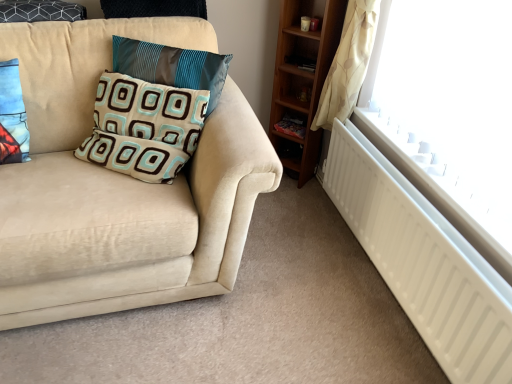
Describe the element at coordinates (12, 116) in the screenshot. This screenshot has width=512, height=384. I see `blue fabric pillow at left, the 1th pillow when ordered from left to right` at that location.

What is the approximate height of patterned fabric pillow at center, acting as the 2th pillow starting from the right?

11.51 inches.

This screenshot has width=512, height=384. Describe the element at coordinates (144, 128) in the screenshot. I see `patterned fabric pillow at center, acting as the 2th pillow starting from the right` at that location.

What do you see at coordinates (423, 261) in the screenshot? Image resolution: width=512 pixels, height=384 pixels. I see `white matte radiator at lower right` at bounding box center [423, 261].

Locate an element on the screen. This screenshot has width=512, height=384. blue fabric pillow at left, acting as the third pillow starting from the right is located at coordinates (12, 116).

Considering the relative sizes of wooden shelf at lower right and patterned fabric pillow at center, acting as the 2th pillow starting from the right, in the image provided, is wooden shelf at lower right thinner than patterned fabric pillow at center, acting as the 2th pillow starting from the right,?

Indeed, wooden shelf at lower right has a lesser width compared to patterned fabric pillow at center, acting as the 2th pillow starting from the right.

Between wooden shelf at lower right and patterned fabric pillow at center, marked as the second pillow in a left-to-right arrangement, which one appears on the left side from the viewer's perspective?

patterned fabric pillow at center, marked as the second pillow in a left-to-right arrangement.

Find the location of a particular element. The width and height of the screenshot is (512, 384). shelf behind the patterned fabric pillow at center, acting as the 2th pillow starting from the right is located at coordinates (292, 124).

From the picture: Is teal satin pillow at upper left, the 3th pillow from the left, in contact with white matte radiator at lower right?

teal satin pillow at upper left, the 3th pillow from the left, and white matte radiator at lower right are not in contact.

In order to click on radiator in front of the teal satin pillow at upper left, the 3th pillow from the left in this screenshot , I will do `click(423, 261)`.

Based on the photo, looking at the image, does teal satin pillow at upper left, arranged as the first pillow when viewed from the right, seem bigger or smaller compared to white matte radiator at lower right?

Considering their sizes, teal satin pillow at upper left, arranged as the first pillow when viewed from the right, takes up less space than white matte radiator at lower right.

From the picture: Which is closer to the camera, (123,53) or (391,239)?

Positioned in front is point (391,239).

Would you consider teal satin pillow at upper left, the 3th pillow from the left, to be distant from wooden shelf at lower right?

They are positioned close to each other.

From the image's perspective, is teal satin pillow at upper left, the 3th pillow from the left, on top of wooden shelf at lower right?

Yes, from the image's perspective, teal satin pillow at upper left, the 3th pillow from the left, is over wooden shelf at lower right.

From a real-world perspective, who is located lower, teal satin pillow at upper left, the 3th pillow from the left, or wooden shelf at lower right?

wooden shelf at lower right.

From the picture: Considering the sizes of objects teal satin pillow at upper left, the 3th pillow from the left, and wooden shelf at lower right in the image provided, who is shorter, teal satin pillow at upper left, the 3th pillow from the left, or wooden shelf at lower right?

With less height is wooden shelf at lower right.

This screenshot has height=384, width=512. What are the coordinates of `the 2nd pillow to the left of the wooden shelf at lower right, counting from the anchor's position` in the screenshot? It's located at [x=144, y=128].

Is point (143, 102) less distant than point (283, 125)?

Yes, point (143, 102) is closer to viewer.

How many degrees apart are the facing directions of patterned fabric pillow at center, marked as the second pillow in a left-to-right arrangement, and wooden shelf at lower right?

patterned fabric pillow at center, marked as the second pillow in a left-to-right arrangement, and wooden shelf at lower right are facing 12.4 degrees away from each other.

Looking at their sizes, would you say patterned fabric pillow at center, marked as the second pillow in a left-to-right arrangement, is wider or thinner than wooden shelf at lower right?

Clearly, patterned fabric pillow at center, marked as the second pillow in a left-to-right arrangement, has more width compared to wooden shelf at lower right.

Is there a large distance between white matte radiator at lower right and patterned fabric pillow at center, marked as the second pillow in a left-to-right arrangement?

white matte radiator at lower right is near patterned fabric pillow at center, marked as the second pillow in a left-to-right arrangement, not far away.

Consider the image. Is white matte radiator at lower right completely or partially outside of patterned fabric pillow at center, acting as the 2th pillow starting from the right?

Indeed, white matte radiator at lower right is completely outside patterned fabric pillow at center, acting as the 2th pillow starting from the right.

Between point (418, 230) and point (113, 160), which one is positioned in front?

The point (418, 230) is more forward.

From a real-world perspective, between wooden shelf at lower right and teal satin pillow at upper left, the 3th pillow from the left, who is vertically lower?

From a 3D spatial view, wooden shelf at lower right is below.

Is wooden shelf at lower right taller than teal satin pillow at upper left, arranged as the first pillow when viewed from the right?

Incorrect, the height of wooden shelf at lower right is not larger of that of teal satin pillow at upper left, arranged as the first pillow when viewed from the right.

Visually, is wooden shelf at lower right positioned to the left or to the right of teal satin pillow at upper left, arranged as the first pillow when viewed from the right?

Clearly, wooden shelf at lower right is on the right of teal satin pillow at upper left, arranged as the first pillow when viewed from the right, in the image.

Can you confirm if wooden shelf at lower right is wider than teal satin pillow at upper left, arranged as the first pillow when viewed from the right?

Incorrect, the width of wooden shelf at lower right does not surpass that of teal satin pillow at upper left, arranged as the first pillow when viewed from the right.

Can you confirm if white matte radiator at lower right is shorter than teal satin pillow at upper left, the 3th pillow from the left?

In fact, white matte radiator at lower right may be taller than teal satin pillow at upper left, the 3th pillow from the left.

Which of these two, white matte radiator at lower right or teal satin pillow at upper left, the 3th pillow from the left, is smaller?

teal satin pillow at upper left, the 3th pillow from the left, is smaller.

Is white matte radiator at lower right further to camera compared to teal satin pillow at upper left, arranged as the first pillow when viewed from the right?

No, white matte radiator at lower right is in front of teal satin pillow at upper left, arranged as the first pillow when viewed from the right.

Where is `the 2nd pillow below the wooden shelf at lower right (from the image's perspective)`? The width and height of the screenshot is (512, 384). the 2nd pillow below the wooden shelf at lower right (from the image's perspective) is located at coordinates (144, 128).

Where is `radiator lying in front of the teal satin pillow at upper left, arranged as the first pillow when viewed from the right`? The width and height of the screenshot is (512, 384). radiator lying in front of the teal satin pillow at upper left, arranged as the first pillow when viewed from the right is located at coordinates (423, 261).

Which object lies further to the anchor point patterned fabric pillow at center, acting as the 2th pillow starting from the right, blue fabric pillow at left, the 1th pillow when ordered from left to right, or suede beige couch at left?

blue fabric pillow at left, the 1th pillow when ordered from left to right.

Looking at the image, which one is located further to white matte radiator at lower right, patterned fabric pillow at center, acting as the 2th pillow starting from the right, or blue fabric pillow at left, acting as the third pillow starting from the right?

blue fabric pillow at left, acting as the third pillow starting from the right.

Looking at the image, which one is located further to suede beige couch at left, white matte radiator at lower right or wooden shelf at lower right?

wooden shelf at lower right is further to suede beige couch at left.

Considering their positions, is teal satin pillow at upper left, the 3th pillow from the left, positioned further to white matte radiator at lower right than wooden shelf at lower right?

teal satin pillow at upper left, the 3th pillow from the left, is further to white matte radiator at lower right.

Looking at the image, which one is located closer to patterned fabric pillow at center, acting as the 2th pillow starting from the right, white matte radiator at lower right or blue fabric pillow at left, the 1th pillow when ordered from left to right?

blue fabric pillow at left, the 1th pillow when ordered from left to right, lies closer to patterned fabric pillow at center, acting as the 2th pillow starting from the right, than the other object.

From the image, which object appears to be nearer to white matte radiator at lower right, wooden shelf at lower right or blue fabric pillow at left, the 1th pillow when ordered from left to right?

wooden shelf at lower right is positioned closer to the anchor white matte radiator at lower right.

From the image, which object appears to be nearer to wooden shelf at lower right, blue fabric pillow at left, acting as the third pillow starting from the right, or teal satin pillow at upper left, arranged as the first pillow when viewed from the right?

teal satin pillow at upper left, arranged as the first pillow when viewed from the right.

Which object lies nearer to the anchor point blue fabric pillow at left, acting as the third pillow starting from the right, patterned fabric pillow at center, marked as the second pillow in a left-to-right arrangement, or teal satin pillow at upper left, arranged as the first pillow when viewed from the right?

Based on the image, patterned fabric pillow at center, marked as the second pillow in a left-to-right arrangement, appears to be nearer to blue fabric pillow at left, acting as the third pillow starting from the right.

This screenshot has width=512, height=384. Find the location of `shelf between blue fabric pillow at left, the 1th pillow when ordered from left to right, and white matte radiator at lower right from left to right`. shelf between blue fabric pillow at left, the 1th pillow when ordered from left to right, and white matte radiator at lower right from left to right is located at coordinates (292, 124).

The image size is (512, 384). I want to click on studio couch between blue fabric pillow at left, the 1th pillow when ordered from left to right, and white matte radiator at lower right, so click(118, 186).

Where is `pillow located between suede beige couch at left and blue fabric pillow at left, the 1th pillow when ordered from left to right, in the depth direction`? The width and height of the screenshot is (512, 384). pillow located between suede beige couch at left and blue fabric pillow at left, the 1th pillow when ordered from left to right, in the depth direction is located at coordinates (144, 128).

Locate an element on the screen. This screenshot has width=512, height=384. studio couch between blue fabric pillow at left, acting as the third pillow starting from the right, and teal satin pillow at upper left, the 3th pillow from the left, in the horizontal direction is located at coordinates (118, 186).